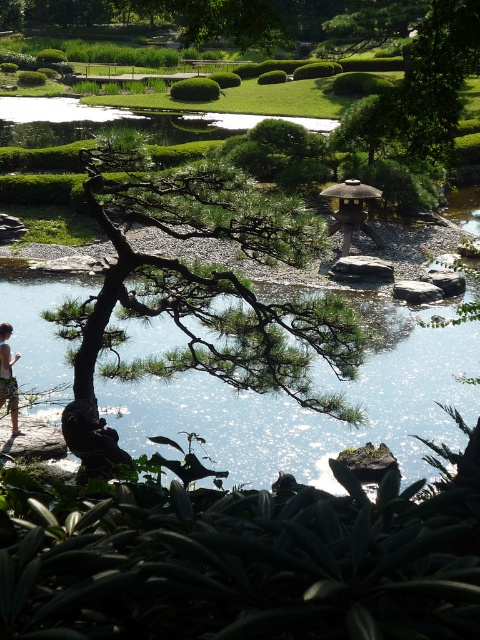
Is green matte tree at center taller than light brown wooden stick at lower left?

Correct, green matte tree at center is much taller as light brown wooden stick at lower left.

Is point (255, 192) less distant than point (17, 410)?

No, (255, 192) is further to viewer.

At what (x,y) coordinates should I click in order to perform the action: click on green matte tree at center. Please return your answer as a coordinate pair (x, y). The image size is (480, 640). Looking at the image, I should click on (200, 289).

Can you confirm if clear water at center is thinner than light brown wooden stick at lower left?

Yes.

Is clear water at center behind light brown wooden stick at lower left?

No, clear water at center is in front of light brown wooden stick at lower left.

Between point (11, 280) and point (2, 355), which one is positioned behind?

The point (11, 280) is behind.

Find the location of a particular element. Image resolution: width=480 pixels, height=640 pixels. clear water at center is located at coordinates (312, 410).

Does green matte tree at center have a greater width compared to clear water at center?

Yes, green matte tree at center is wider than clear water at center.

Is point (135, 310) behind point (186, 400)?

No, it is not.

Describe the element at coordinates (200, 289) in the screenshot. The image size is (480, 640). I see `green matte tree at center` at that location.

This screenshot has height=640, width=480. In order to click on green matte tree at center in this screenshot , I will do pos(200,289).